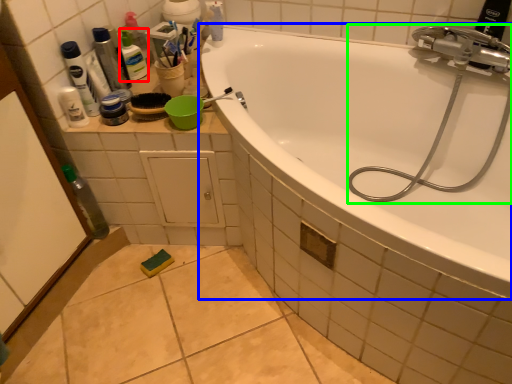
Question: Estimate the real-world distances between objects in this image. Which object is farther from toiletry (highlighted by a red box), bathtub (highlighted by a blue box) or garden hose (highlighted by a green box)?

Choices:
 (A) bathtub
 (B) garden hose

Answer: (B)